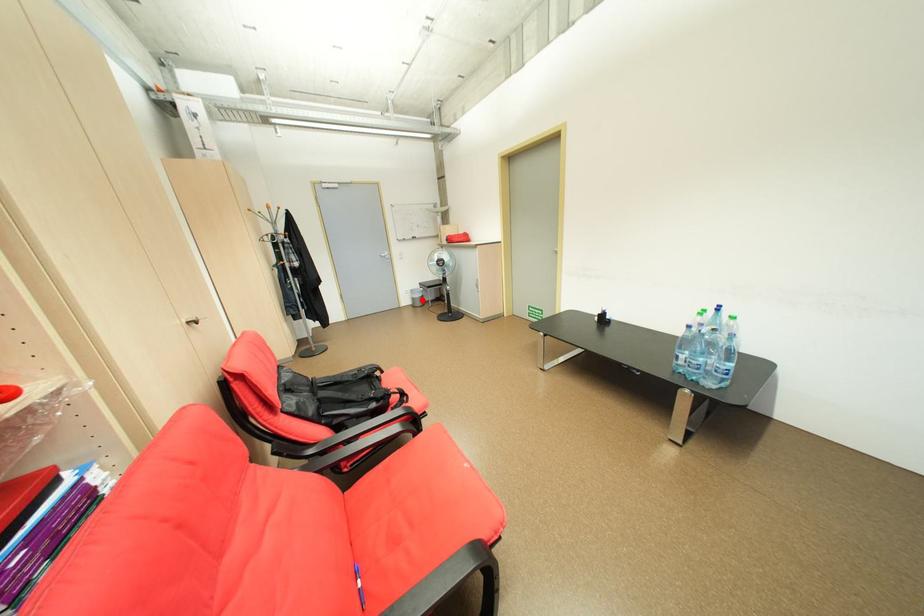
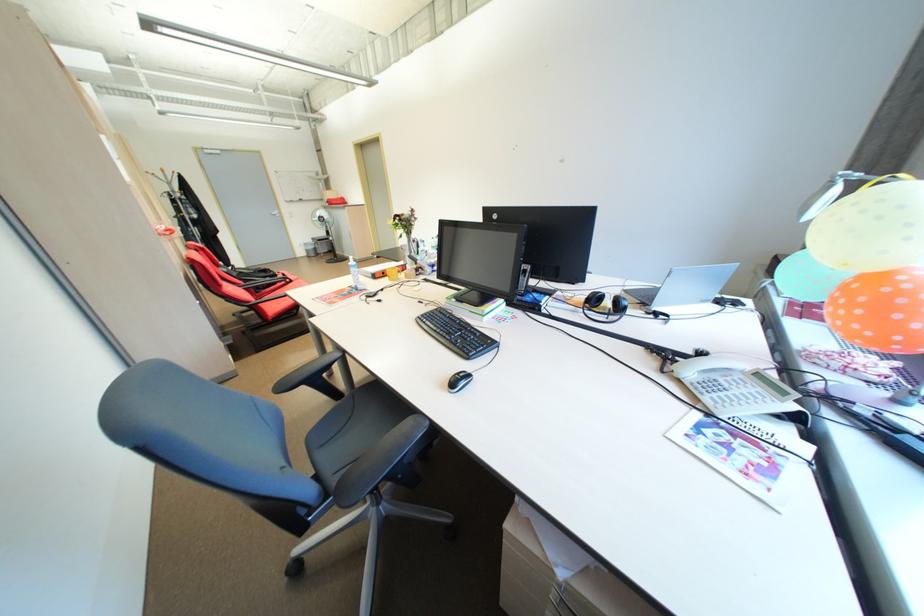
Question: A red point is marked in image1. In image2, is the corresponding 3D point closer to the camera or farther? Reply with the corresponding letter.

Choices:
 (A) The corresponding 3D point is closer.
 (B) The corresponding 3D point is farther.

Answer: (A)